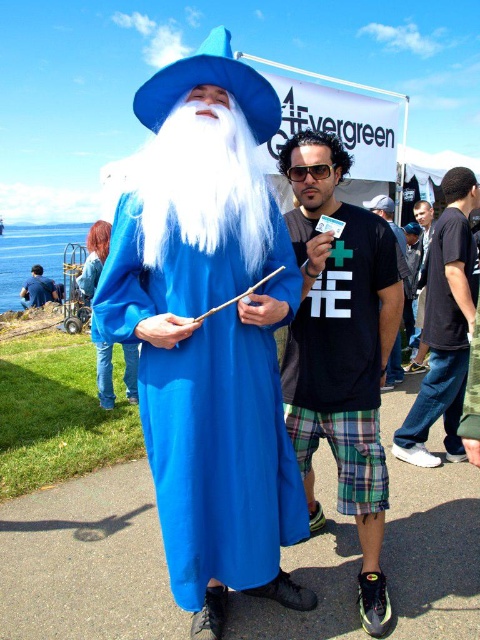
Which is more to the right, white fluffy beard at center or denim shorts at center?

From the viewer's perspective, denim shorts at center appears more on the right side.

Based on the photo, who is lower down, white fluffy beard at center or denim shorts at center?

white fluffy beard at center is below.

Is point (265, 202) closer to camera compared to point (410, 364)?

Yes, point (265, 202) is closer to viewer.

At what (x,y) coordinates should I click in order to perform the action: click on white fluffy beard at center. Please return your answer as a coordinate pair (x, y). The width and height of the screenshot is (480, 640). Looking at the image, I should click on (203, 186).

Who is more forward, [342,364] or [36,300]?

Point [342,364] is more forward.

Is plaid shorts at center further to camera compared to blue fabric wizard costume at left?

No.

Does point (360, 620) come farther from viewer compared to point (40, 278)?

No, it is not.

Where is `plaid shorts at center`? Image resolution: width=480 pixels, height=640 pixels. plaid shorts at center is located at coordinates (340, 349).

At what (x,y) coordinates should I click in order to perform the action: click on plaid shorts at center. Please return your answer as a coordinate pair (x, y). Looking at the image, I should click on (340, 349).

Is plaid shorts at center wider than denim shorts at center?

No.

Identify the location of plaid shorts at center. (340, 349).